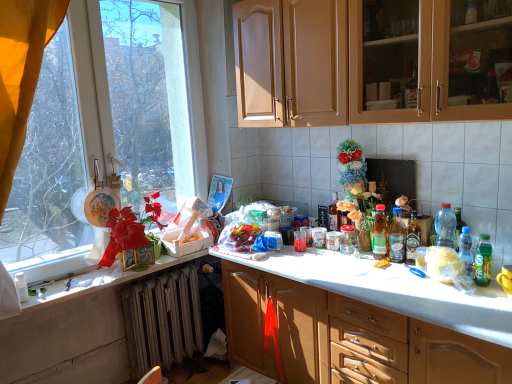
Question: Does translucent plastic bottle at right, arranged as the 5th bottle when viewed from the left, have a larger size compared to matte wood cabinets at upper center, acting as the first cabinetry starting from the top?

Choices:
 (A) no
 (B) yes

Answer: (A)

Question: From the image's perspective, would you say translucent plastic bottle at right, marked as the 2th bottle in a right-to-left arrangement, is positioned over matte wood cabinets at upper center, marked as the 2th cabinetry in a bottom-to-top arrangement?

Choices:
 (A) no
 (B) yes

Answer: (A)

Question: Is translucent plastic bottle at right, marked as the fifth bottle in a back-to-front arrangement, not near matte wood cabinets at upper center, acting as the first cabinetry starting from the top?

Choices:
 (A) yes
 (B) no

Answer: (B)

Question: From a real-world perspective, is translucent plastic bottle at right, marked as the fifth bottle in a back-to-front arrangement, on top of matte wood cabinets at upper center, acting as the first cabinetry starting from the top?

Choices:
 (A) yes
 (B) no

Answer: (B)

Question: Is the position of translucent plastic bottle at right, arranged as the 5th bottle when viewed from the left, more distant than that of matte wood cabinets at upper center, acting as the first cabinetry starting from the top?

Choices:
 (A) yes
 (B) no

Answer: (A)

Question: Does translucent plastic bottle at right, marked as the 2th bottle in a right-to-left arrangement, turn towards matte wood cabinets at upper center, acting as the first cabinetry starting from the top?

Choices:
 (A) no
 (B) yes

Answer: (A)

Question: Is matte wood cabinets at upper center, marked as the 2th cabinetry in a bottom-to-top arrangement, outside of matte brown cabinets at center, which appears as the 2th cabinetry when viewed from the top?

Choices:
 (A) no
 (B) yes

Answer: (B)

Question: From the image's perspective, would you say matte wood cabinets at upper center, marked as the 2th cabinetry in a bottom-to-top arrangement, is positioned over matte brown cabinets at center, which appears as the 2th cabinetry when viewed from the top?

Choices:
 (A) yes
 (B) no

Answer: (A)

Question: From a real-world perspective, does matte wood cabinets at upper center, acting as the first cabinetry starting from the top, sit lower than matte brown cabinets at center, which ranks as the 1th cabinetry in bottom-to-top order?

Choices:
 (A) no
 (B) yes

Answer: (A)

Question: Is matte wood cabinets at upper center, marked as the 2th cabinetry in a bottom-to-top arrangement, taller than matte brown cabinets at center, which ranks as the 1th cabinetry in bottom-to-top order?

Choices:
 (A) no
 (B) yes

Answer: (A)

Question: Is there a large distance between matte wood cabinets at upper center, acting as the first cabinetry starting from the top, and matte brown cabinets at center, which ranks as the 1th cabinetry in bottom-to-top order?

Choices:
 (A) no
 (B) yes

Answer: (B)

Question: From a real-world perspective, is matte wood cabinets at upper center, acting as the first cabinetry starting from the top, over matte brown cabinets at center, which ranks as the 1th cabinetry in bottom-to-top order?

Choices:
 (A) yes
 (B) no

Answer: (A)

Question: Does green matte bottle at right, which is counted as the sixth bottle, starting from the left, appear on the left side of transparent glass window at upper left?

Choices:
 (A) yes
 (B) no

Answer: (B)